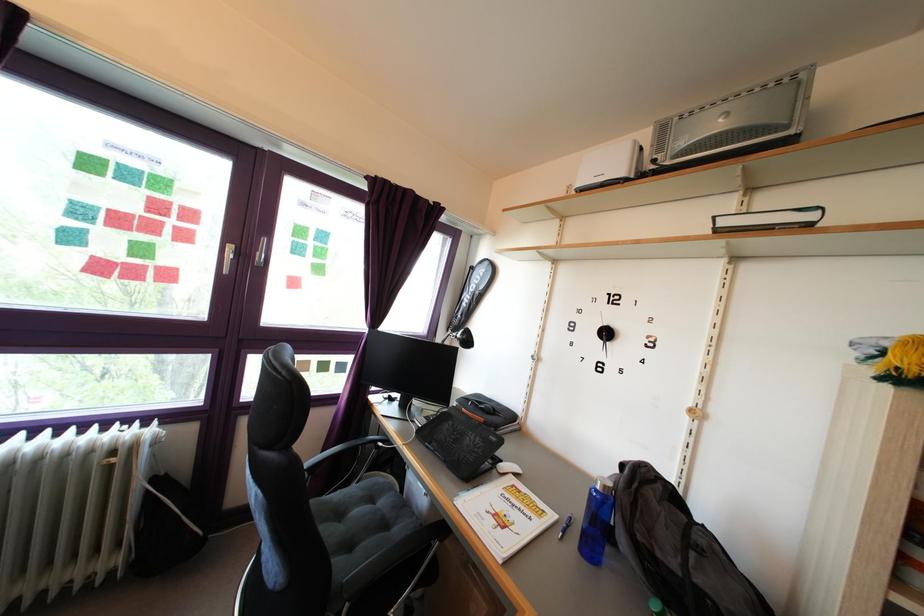
Find where to lift the white toaster. Please return your answer as a coordinate pair (x, y).

(610, 166)